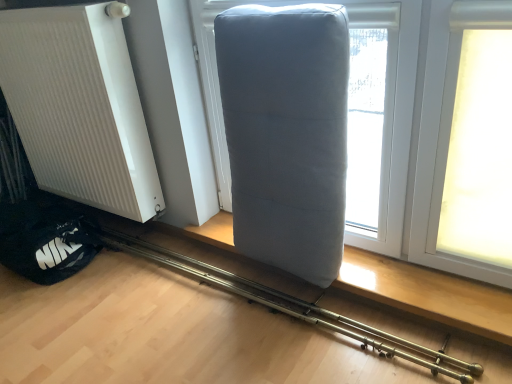
Question: Is white ribbed radiator at left far away from matte gray pillow at center?

Choices:
 (A) no
 (B) yes

Answer: (A)

Question: Is white ribbed radiator at left positioned with its back to matte gray pillow at center?

Choices:
 (A) yes
 (B) no

Answer: (B)

Question: Considering the relative sizes of white ribbed radiator at left and matte gray pillow at center in the image provided, is white ribbed radiator at left taller than matte gray pillow at center?

Choices:
 (A) no
 (B) yes

Answer: (B)

Question: From the image's perspective, would you say white ribbed radiator at left is positioned over matte gray pillow at center?

Choices:
 (A) yes
 (B) no

Answer: (A)

Question: Considering the relative sizes of white ribbed radiator at left and matte gray pillow at center in the image provided, is white ribbed radiator at left wider than matte gray pillow at center?

Choices:
 (A) yes
 (B) no

Answer: (B)

Question: Is white ribbed radiator at left at the right side of matte gray pillow at center?

Choices:
 (A) yes
 (B) no

Answer: (B)

Question: From a real-world perspective, is gray fabric pillow at center over matte gray pillow at center?

Choices:
 (A) no
 (B) yes

Answer: (B)

Question: Considering the relative sizes of gray fabric pillow at center and matte gray pillow at center in the image provided, is gray fabric pillow at center wider than matte gray pillow at center?

Choices:
 (A) yes
 (B) no

Answer: (B)

Question: From the image's perspective, is gray fabric pillow at center located above matte gray pillow at center?

Choices:
 (A) yes
 (B) no

Answer: (A)

Question: Is gray fabric pillow at center completely or partially outside of matte gray pillow at center?

Choices:
 (A) yes
 (B) no

Answer: (A)

Question: Is gray fabric pillow at center not close to matte gray pillow at center?

Choices:
 (A) no
 (B) yes

Answer: (A)

Question: Can you confirm if gray fabric pillow at center is thinner than matte gray pillow at center?

Choices:
 (A) yes
 (B) no

Answer: (A)

Question: Are white ribbed radiator at left and gray fabric pillow at center located far from each other?

Choices:
 (A) no
 (B) yes

Answer: (A)